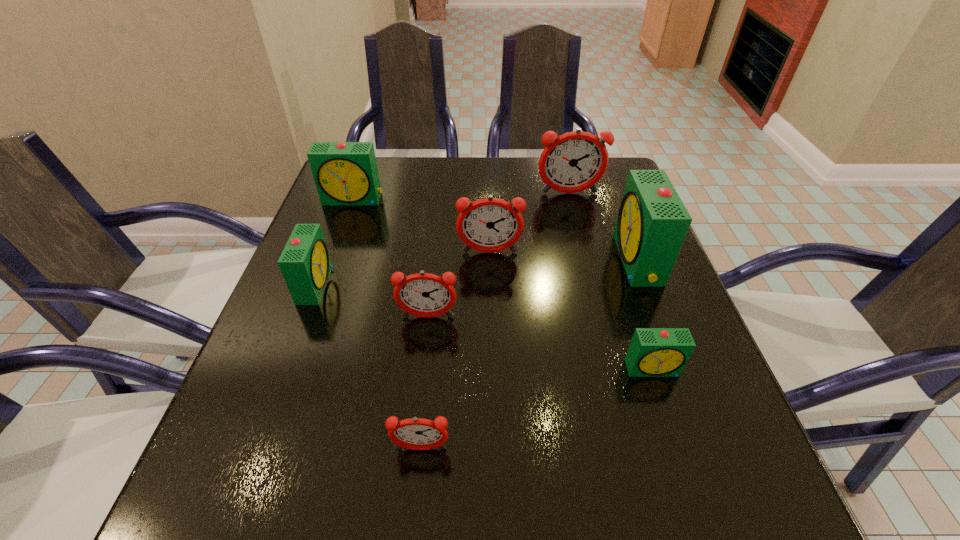
Locate an element on the screen. free location located 0.060m on the front-facing side of the smallest reddish-pink alarm clock is located at coordinates (417, 498).

The height and width of the screenshot is (540, 960). Identify the location of free space located on the front-facing side of the smallest green alarm clock. (668, 416).

Where is `object at the far left corner`? object at the far left corner is located at coordinates (345, 173).

This screenshot has width=960, height=540. I want to click on object that is positioned at the far right corner, so click(x=575, y=161).

Find the location of a particular element. Image resolution: width=960 pixels, height=540 pixels. vacant space at the far edge of the desktop is located at coordinates (492, 177).

Where is `vacant space at the left edge of the desktop`? This screenshot has width=960, height=540. vacant space at the left edge of the desktop is located at coordinates (327, 223).

This screenshot has height=540, width=960. I want to click on free region at the right edge of the desktop, so click(673, 288).

Identify the location of vacant area at the far left corner of the desktop. (387, 167).

In the image, there is a desktop. Identify the location of vacant space at the near left corner. This screenshot has width=960, height=540. (253, 517).

In the image, there is a desktop. Where is `free space at the far right corner`? This screenshot has width=960, height=540. free space at the far right corner is located at coordinates (595, 200).